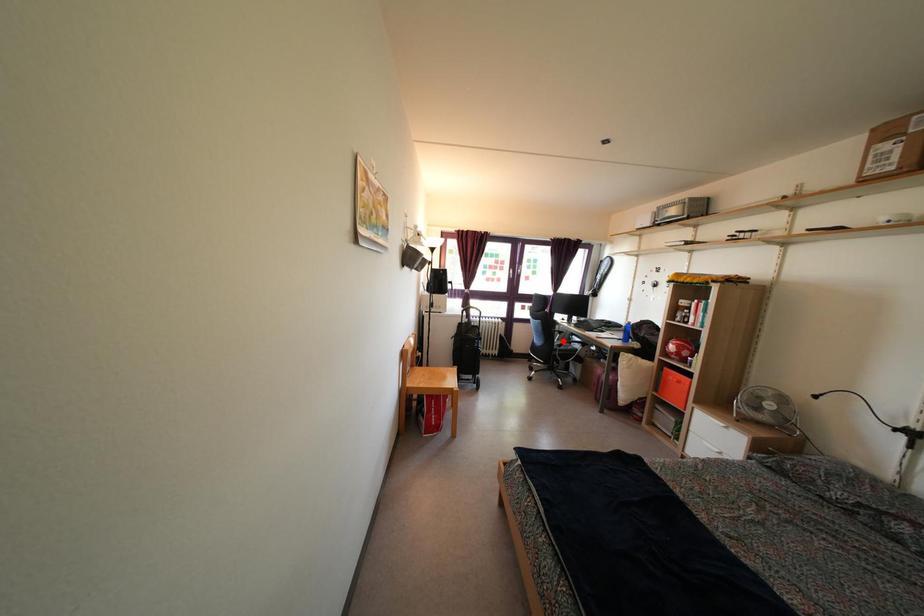
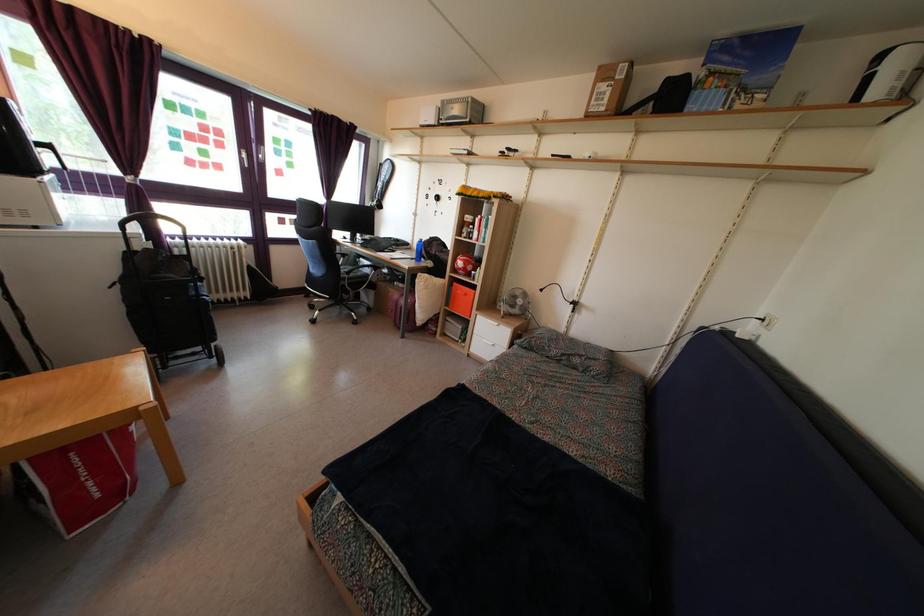
In the second image, find the point that corresponds to the highlighted location in the first image.

(346, 264)